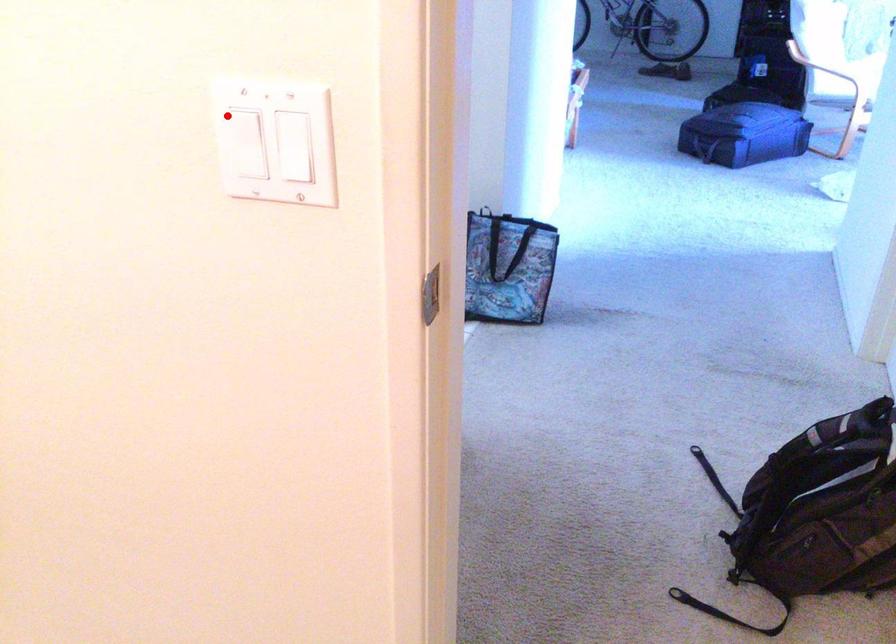
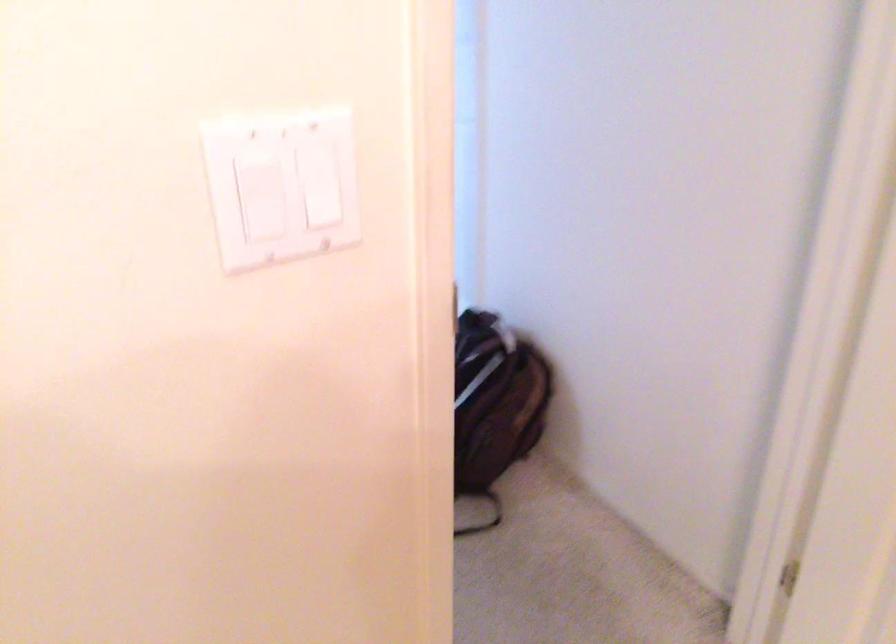
Question: I am providing you with two images of the same scene from different viewpoints. Image1 has a red point marked. In image2, the corresponding 3D location appears at what relative position? Reply with the corresponding letter.

Choices:
 (A) Closer
 (B) Farther

Answer: (A)